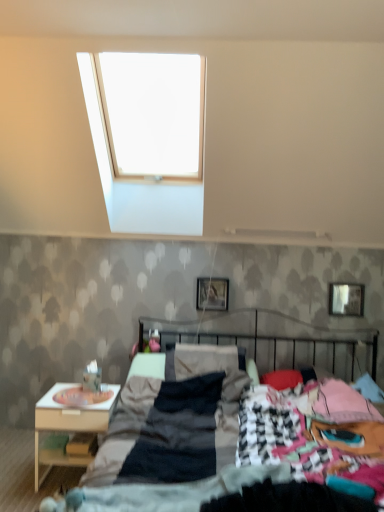
What do you see at coordinates (171, 420) in the screenshot? I see `dark gray fabric bed at center` at bounding box center [171, 420].

Where is `white wood nightstand at lower left`? The height and width of the screenshot is (512, 384). white wood nightstand at lower left is located at coordinates (69, 424).

What do you see at coordinates (69, 424) in the screenshot?
I see `white wood nightstand at lower left` at bounding box center [69, 424].

Measure the distance between point (215, 310) and camera.

Point (215, 310) and camera are 3.41 meters apart.

What is the approximate width of metallic silver picture frame at center, which ranks as the 2th picture frame in right-to-left order?

metallic silver picture frame at center, which ranks as the 2th picture frame in right-to-left order, is 2.41 inches in width.

What do you see at coordinates (346, 298) in the screenshot?
I see `metallic silver picture frame at upper right, which is the second picture frame in left-to-right order` at bounding box center [346, 298].

The height and width of the screenshot is (512, 384). I want to click on dark gray fabric bed at center, so click(171, 420).

Is metallic silver picture frame at upper right, which is the second picture frame in left-to-right order, placed right next to metallic silver picture frame at center, which ranks as the 2th picture frame in right-to-left order?

No, metallic silver picture frame at upper right, which is the second picture frame in left-to-right order, is not with metallic silver picture frame at center, which ranks as the 2th picture frame in right-to-left order.

From the image's perspective, which is above, metallic silver picture frame at upper right, the 1th picture frame viewed from the right, or metallic silver picture frame at center, which ranks as the 2th picture frame in right-to-left order?

metallic silver picture frame at center, which ranks as the 2th picture frame in right-to-left order, appears higher in the image.

Is metallic silver picture frame at upper right, the 1th picture frame viewed from the right, turned away from metallic silver picture frame at center, which is the first picture frame from left to right?

No.

Which of these two, dark gray fabric bed at center or white wood nightstand at lower left, is smaller?

white wood nightstand at lower left is smaller.

Is dark gray fabric bed at center spatially inside white wood nightstand at lower left, or outside of it?

dark gray fabric bed at center cannot be found inside white wood nightstand at lower left.

Measure the distance between dark gray fabric bed at center and white wood nightstand at lower left.

A distance of 20.68 inches exists between dark gray fabric bed at center and white wood nightstand at lower left.

Locate an element on the screen. picture frame lying on the right of dark gray fabric bed at center is located at coordinates (346, 298).

Would you say dark gray fabric bed at center is a long distance from metallic silver picture frame at upper right, the 1th picture frame viewed from the right?

dark gray fabric bed at center is far away from metallic silver picture frame at upper right, the 1th picture frame viewed from the right.

From a real-world perspective, is dark gray fabric bed at center under metallic silver picture frame at upper right, which is the second picture frame in left-to-right order?

Indeed, from a real-world perspective, dark gray fabric bed at center is positioned beneath metallic silver picture frame at upper right, which is the second picture frame in left-to-right order.

Which is in front, dark gray fabric bed at center or metallic silver picture frame at upper right, which is the second picture frame in left-to-right order?

dark gray fabric bed at center.

Can you confirm if white wood nightstand at lower left is bigger than metallic silver picture frame at upper right, the 1th picture frame viewed from the right?

Yes.

Is white wood nightstand at lower left wider than metallic silver picture frame at upper right, which is the second picture frame in left-to-right order?

Yes.

Based on the photo, considering their positions, is white wood nightstand at lower left located in front of or behind metallic silver picture frame at upper right, the 1th picture frame viewed from the right?

In the image, white wood nightstand at lower left appears in front of metallic silver picture frame at upper right, the 1th picture frame viewed from the right.

Can we say white wood nightstand at lower left lies outside metallic silver picture frame at upper right, the 1th picture frame viewed from the right?

Yes, white wood nightstand at lower left is not within metallic silver picture frame at upper right, the 1th picture frame viewed from the right.

Between white wood nightstand at lower left and dark gray fabric bed at center, which one has larger size?

With larger size is dark gray fabric bed at center.

Is white wood nightstand at lower left placed right next to dark gray fabric bed at center?

No.

Which is further, [96,411] or [257,341]?

Positioned behind is point [257,341].

Considering the relative sizes of white wood nightstand at lower left and dark gray fabric bed at center in the image provided, is white wood nightstand at lower left thinner than dark gray fabric bed at center?

Correct, the width of white wood nightstand at lower left is less than that of dark gray fabric bed at center.

Is metallic silver picture frame at center, which ranks as the 2th picture frame in right-to-left order, placed right next to dark gray fabric bed at center?

No, metallic silver picture frame at center, which ranks as the 2th picture frame in right-to-left order, is not with dark gray fabric bed at center.

From a real-world perspective, which object stands above the other?

From a 3D spatial view, metallic silver picture frame at center, which is the first picture frame from left to right, is above.

From the image's perspective, relative to dark gray fabric bed at center, is metallic silver picture frame at center, which ranks as the 2th picture frame in right-to-left order, above or below?

From the image's perspective, metallic silver picture frame at center, which ranks as the 2th picture frame in right-to-left order, appears above dark gray fabric bed at center.

Is dark gray fabric bed at center surrounded by metallic silver picture frame at center, which is the first picture frame from left to right?

No, metallic silver picture frame at center, which is the first picture frame from left to right, does not contain dark gray fabric bed at center.

How distant is metallic silver picture frame at upper right, which is the second picture frame in left-to-right order, from white wood nightstand at lower left?

They are 2.02 meters apart.

From a real-world perspective, does metallic silver picture frame at upper right, which is the second picture frame in left-to-right order, sit lower than white wood nightstand at lower left?

No, from a real-world perspective, metallic silver picture frame at upper right, which is the second picture frame in left-to-right order, is not beneath white wood nightstand at lower left.

Is metallic silver picture frame at upper right, which is the second picture frame in left-to-right order, oriented towards white wood nightstand at lower left?

No.

Is point (359, 297) closer to camera compared to point (79, 428)?

No, it is not.

Image resolution: width=384 pixels, height=512 pixels. In order to click on picture frame on the right side of metallic silver picture frame at center, which ranks as the 2th picture frame in right-to-left order in this screenshot , I will do `click(346, 298)`.

This screenshot has width=384, height=512. Find the location of `bed that is above the white wood nightstand at lower left (from a real-world perspective)`. bed that is above the white wood nightstand at lower left (from a real-world perspective) is located at coordinates (171, 420).

Based on the photo, considering their positions, is dark gray fabric bed at center positioned closer to metallic silver picture frame at center, which is the first picture frame from left to right, than metallic silver picture frame at upper right, the 1th picture frame viewed from the right?

dark gray fabric bed at center lies closer to metallic silver picture frame at center, which is the first picture frame from left to right, than the other object.

When comparing their distances from metallic silver picture frame at upper right, which is the second picture frame in left-to-right order, does dark gray fabric bed at center or metallic silver picture frame at center, which ranks as the 2th picture frame in right-to-left order, seem further?

Based on the image, dark gray fabric bed at center appears to be further to metallic silver picture frame at upper right, which is the second picture frame in left-to-right order.

When comparing their distances from white wood nightstand at lower left, does dark gray fabric bed at center or metallic silver picture frame at upper right, which is the second picture frame in left-to-right order, seem further?

Among the two, metallic silver picture frame at upper right, which is the second picture frame in left-to-right order, is located further to white wood nightstand at lower left.

From the image, which object appears to be farther from metallic silver picture frame at upper right, the 1th picture frame viewed from the right, metallic silver picture frame at center, which ranks as the 2th picture frame in right-to-left order, or white wood nightstand at lower left?

Result: white wood nightstand at lower left lies further to metallic silver picture frame at upper right, the 1th picture frame viewed from the right, than the other object.

Based on their spatial positions, is white wood nightstand at lower left or dark gray fabric bed at center further from metallic silver picture frame at upper right, which is the second picture frame in left-to-right order?

white wood nightstand at lower left is positioned further to the anchor metallic silver picture frame at upper right, which is the second picture frame in left-to-right order.

Which object lies further to the anchor point metallic silver picture frame at center, which ranks as the 2th picture frame in right-to-left order, metallic silver picture frame at upper right, which is the second picture frame in left-to-right order, or dark gray fabric bed at center?

metallic silver picture frame at upper right, which is the second picture frame in left-to-right order, is positioned further to the anchor metallic silver picture frame at center, which ranks as the 2th picture frame in right-to-left order.

Looking at this image, considering their positions, is metallic silver picture frame at upper right, which is the second picture frame in left-to-right order, positioned closer to metallic silver picture frame at center, which ranks as the 2th picture frame in right-to-left order, than white wood nightstand at lower left?

metallic silver picture frame at upper right, which is the second picture frame in left-to-right order.

Based on their spatial positions, is metallic silver picture frame at upper right, the 1th picture frame viewed from the right, or white wood nightstand at lower left closer to dark gray fabric bed at center?

white wood nightstand at lower left.

The image size is (384, 512). I want to click on picture frame between dark gray fabric bed at center and metallic silver picture frame at center, which ranks as the 2th picture frame in right-to-left order, from front to back, so click(346, 298).

Locate an element on the screen. The width and height of the screenshot is (384, 512). nightstand between dark gray fabric bed at center and metallic silver picture frame at center, which ranks as the 2th picture frame in right-to-left order, along the z-axis is located at coordinates (69, 424).

The height and width of the screenshot is (512, 384). What are the coordinates of `picture frame between white wood nightstand at lower left and metallic silver picture frame at upper right, the 1th picture frame viewed from the right, in the horizontal direction` in the screenshot? It's located at (212, 294).

Where is `nightstand located between dark gray fabric bed at center and metallic silver picture frame at upper right, which is the second picture frame in left-to-right order, in the depth direction`? The height and width of the screenshot is (512, 384). nightstand located between dark gray fabric bed at center and metallic silver picture frame at upper right, which is the second picture frame in left-to-right order, in the depth direction is located at coordinates (69, 424).